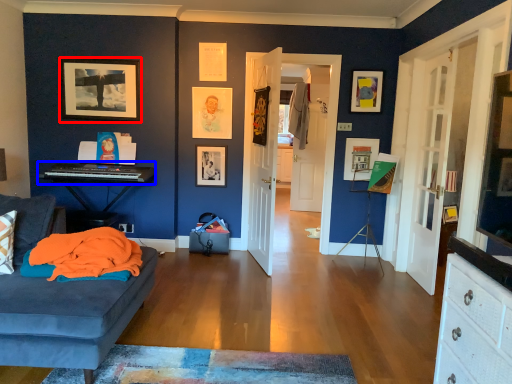
Question: Which point is further to the camera, picture frame (highlighted by a red box) or musical keyboard (highlighted by a blue box)?

Choices:
 (A) picture frame
 (B) musical keyboard

Answer: (A)